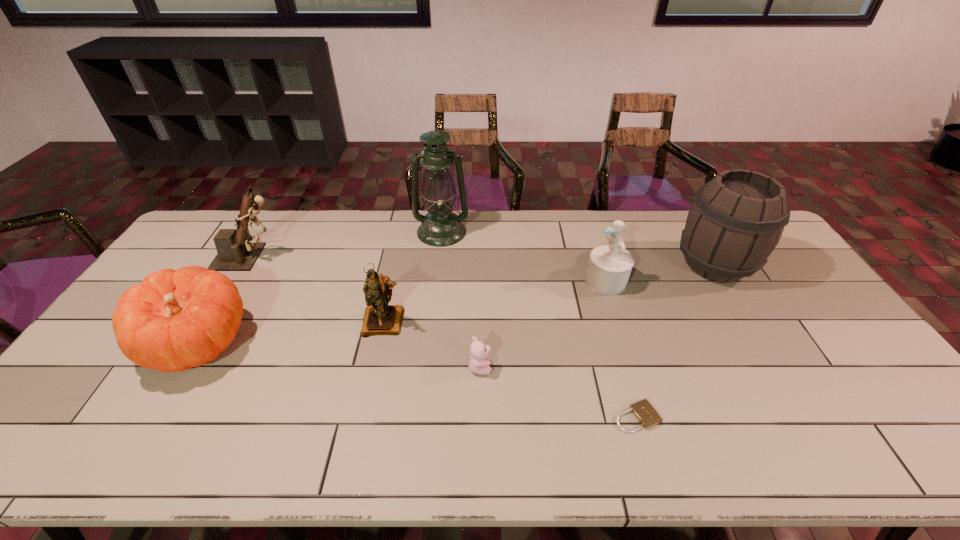
The image size is (960, 540). Identify the location of oil lamp. (441, 227).

Where is `the rightmost object`? This screenshot has width=960, height=540. the rightmost object is located at coordinates (736, 220).

Image resolution: width=960 pixels, height=540 pixels. In order to click on the leftmost figurine in this screenshot , I will do `click(237, 251)`.

In order to click on the rightmost figurine in this screenshot , I will do `click(609, 266)`.

The height and width of the screenshot is (540, 960). I want to click on the second figurine from right to left, so click(380, 318).

I want to click on pumpkin, so click(174, 320).

Identify the location of teddy bear. The image size is (960, 540). (478, 364).

The height and width of the screenshot is (540, 960). I want to click on the seventh tallest object, so click(478, 364).

The image size is (960, 540). Identify the location of the nearest object. (644, 412).

At what (x,y) coordinates should I click in order to perform the action: click on the shortest object. Please return your answer as a coordinate pair (x, y). This screenshot has width=960, height=540. Looking at the image, I should click on coord(644,412).